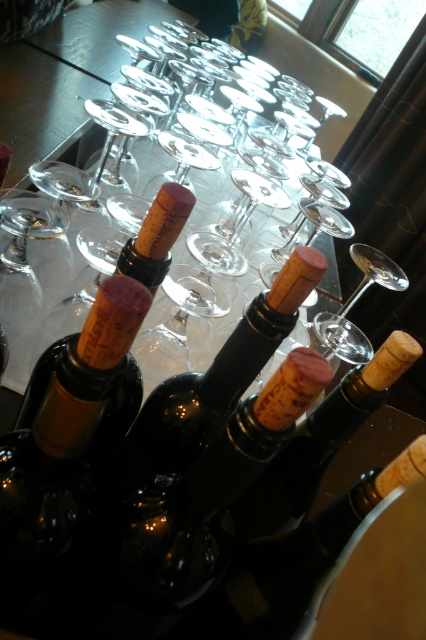
Question: Does brown corked bottle at center come in front of clear glass wine glass at center?

Choices:
 (A) yes
 (B) no

Answer: (A)

Question: In this image, where is brown corked bottle at center located relative to clear glass wine glass at center?

Choices:
 (A) below
 (B) above

Answer: (A)

Question: Among these objects, which one is farthest from the camera?

Choices:
 (A) clear glass wine glass at center
 (B) brown corked bottle at center

Answer: (A)

Question: Can you confirm if brown corked bottle at center is bigger than clear glass wine glass at center?

Choices:
 (A) no
 (B) yes

Answer: (A)

Question: Which of the following is the closest to the observer?

Choices:
 (A) brown corked bottle at center
 (B) clear glass wine glass at center

Answer: (A)

Question: Which of the following is the closest to the observer?

Choices:
 (A) clear glass wine glass at center
 (B) brown corked bottle at center

Answer: (B)